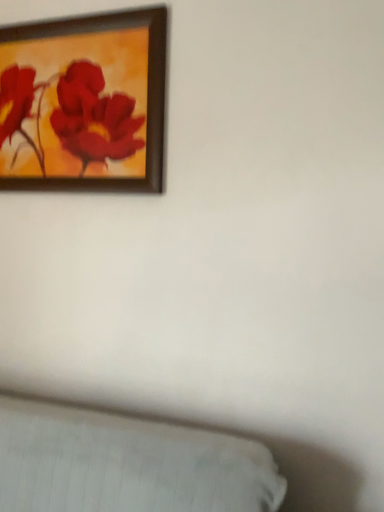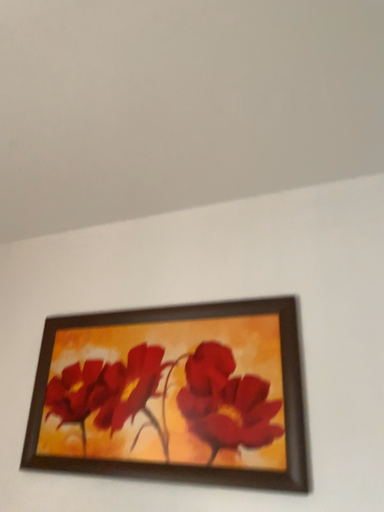
Question: Which way did the camera rotate in the video?

Choices:
 (A) rotated upward
 (B) rotated downward

Answer: (A)